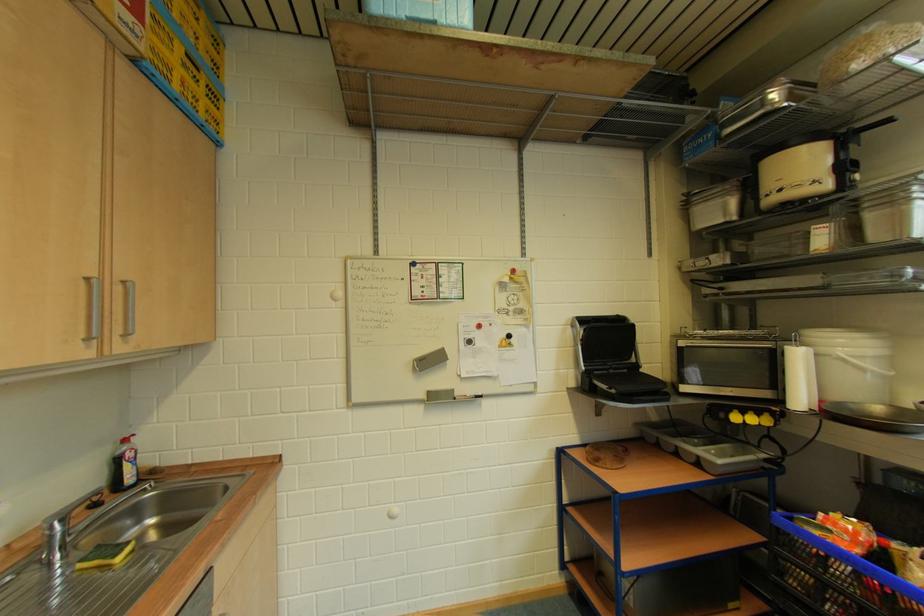
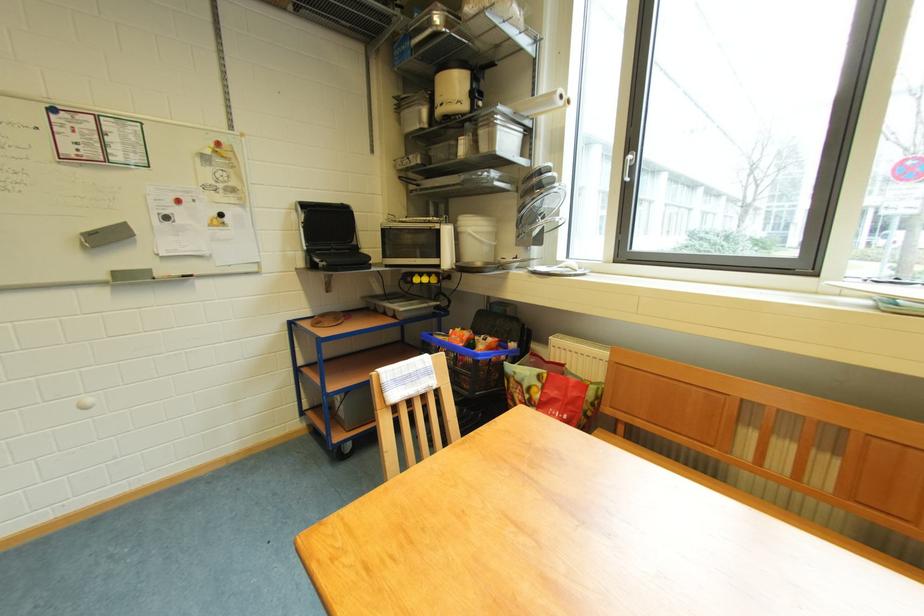
Where in the second image is the point corresponding to pixel 823 139 from the first image?

(469, 68)